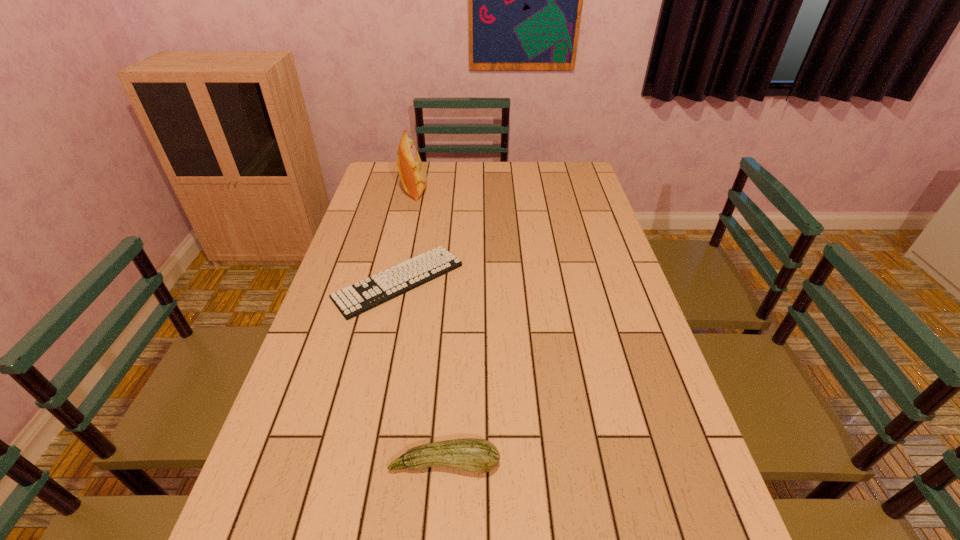
The image size is (960, 540). Find the location of `free point that satisfies the following two spatial constraints: 1. on the back side of the computer keyboard; 2. on the front-facing side of the crisp (potato chip)`. free point that satisfies the following two spatial constraints: 1. on the back side of the computer keyboard; 2. on the front-facing side of the crisp (potato chip) is located at coordinates (418, 191).

What are the coordinates of `vacant region that satisfies the following two spatial constraints: 1. on the front-facing side of the second nearest object; 2. on the left side of the farthest object` in the screenshot? It's located at (395, 281).